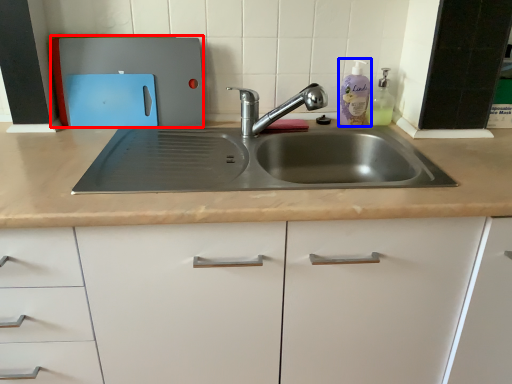
Question: Which point is further to the camera, appliance (highlighted by a red box) or cleaning product (highlighted by a blue box)?

Choices:
 (A) appliance
 (B) cleaning product

Answer: (B)